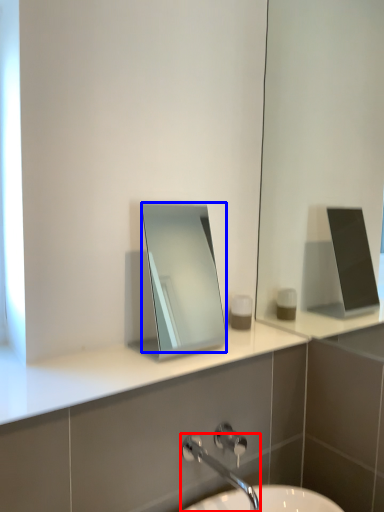
Question: Which object is further to the camera taking this photo, tap (highlighted by a red box) or mirror (highlighted by a blue box)?

Choices:
 (A) tap
 (B) mirror

Answer: (B)